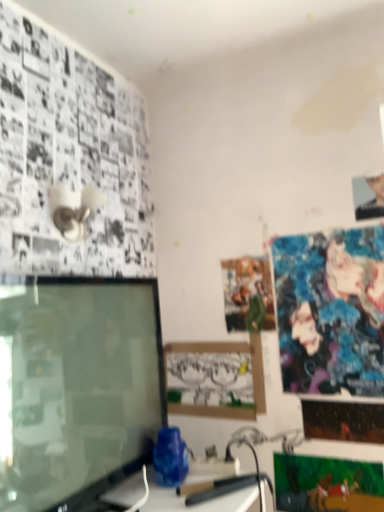
Question: From a real-world perspective, is matte paper poster at center, which ranks as the first poster page in top-to-bottom order, physically above shiny blue fabric poster at upper right, the 3th poster page in the bottom-to-top sequence?

Choices:
 (A) yes
 (B) no

Answer: (A)

Question: Is matte paper poster at center, which ranks as the first poster page in top-to-bottom order, not within shiny blue fabric poster at upper right, the second poster page in the top-to-bottom sequence?

Choices:
 (A) yes
 (B) no

Answer: (A)

Question: From the image's perspective, does matte paper poster at center, which appears as the 4th poster page when ordered from the bottom, appear higher than shiny blue fabric poster at upper right, the second poster page in the top-to-bottom sequence?

Choices:
 (A) no
 (B) yes

Answer: (B)

Question: Does matte paper poster at center, which ranks as the first poster page in top-to-bottom order, have a larger size compared to shiny blue fabric poster at upper right, the 3th poster page in the bottom-to-top sequence?

Choices:
 (A) yes
 (B) no

Answer: (B)

Question: Does matte paper poster at center, which appears as the 4th poster page when ordered from the bottom, have a greater width compared to shiny blue fabric poster at upper right, the 3th poster page in the bottom-to-top sequence?

Choices:
 (A) no
 (B) yes

Answer: (B)

Question: Relative to shiny metallic poster at lower right, which is the 2th poster page in bottom-to-top order, is smooth skin portrait at upper right in front or behind?

Choices:
 (A) behind
 (B) front

Answer: (A)

Question: Does point (380, 201) appear closer or farther from the camera than point (350, 408)?

Choices:
 (A) farther
 (B) closer

Answer: (B)

Question: Based on their sizes in the image, would you say smooth skin portrait at upper right is bigger or smaller than shiny metallic poster at lower right, which is the 2th poster page in bottom-to-top order?

Choices:
 (A) big
 (B) small

Answer: (B)

Question: From a real-world perspective, is smooth skin portrait at upper right above or below shiny metallic poster at lower right, the 3th poster page from the top?

Choices:
 (A) below
 (B) above

Answer: (B)

Question: From a real-world perspective, is smooth skin portrait at upper right physically located above or below matte black monitor at left?

Choices:
 (A) above
 (B) below

Answer: (A)

Question: Does point (367, 180) appear closer or farther from the camera than point (71, 506)?

Choices:
 (A) closer
 (B) farther

Answer: (B)

Question: Relative to matte black monitor at left, is smooth skin portrait at upper right in front or behind?

Choices:
 (A) behind
 (B) front

Answer: (A)

Question: Based on their positions, is smooth skin portrait at upper right located to the left or right of matte black monitor at left?

Choices:
 (A) left
 (B) right

Answer: (B)

Question: Would you say smooth skin portrait at upper right is inside or outside matte cardboard picture frame at center?

Choices:
 (A) outside
 (B) inside

Answer: (A)

Question: From a real-world perspective, is smooth skin portrait at upper right positioned above or below matte cardboard picture frame at center?

Choices:
 (A) below
 (B) above

Answer: (B)